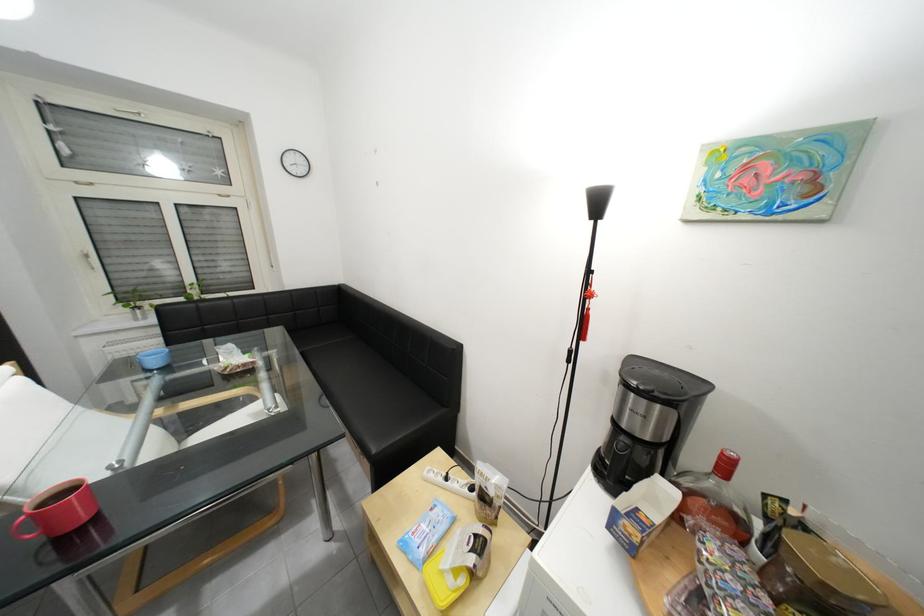
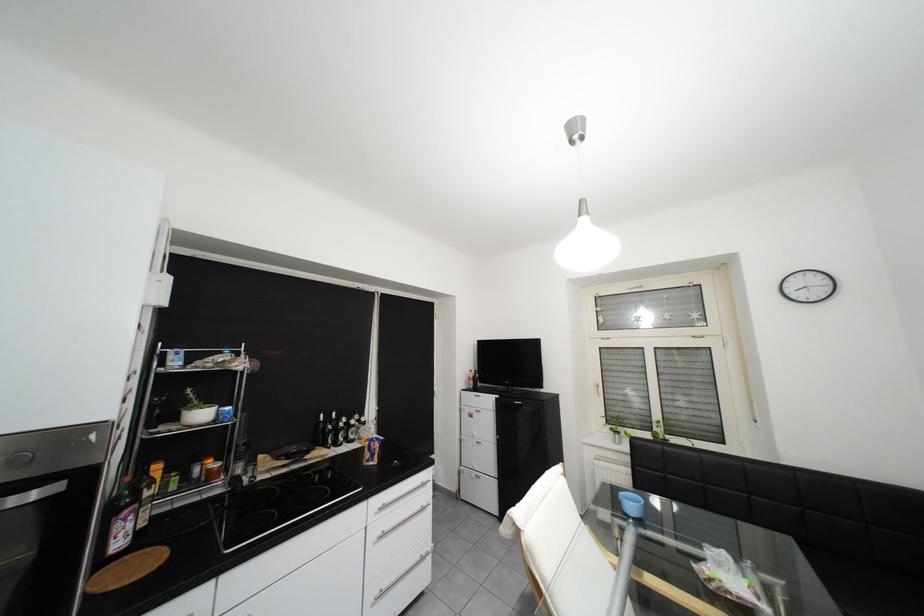
Question: The first image is from the beginning of the video and the second image is from the end. How did the camera likely rotate when shooting the video?

Choices:
 (A) Left
 (B) Right
 (C) Up
 (D) Down

Answer: (A)